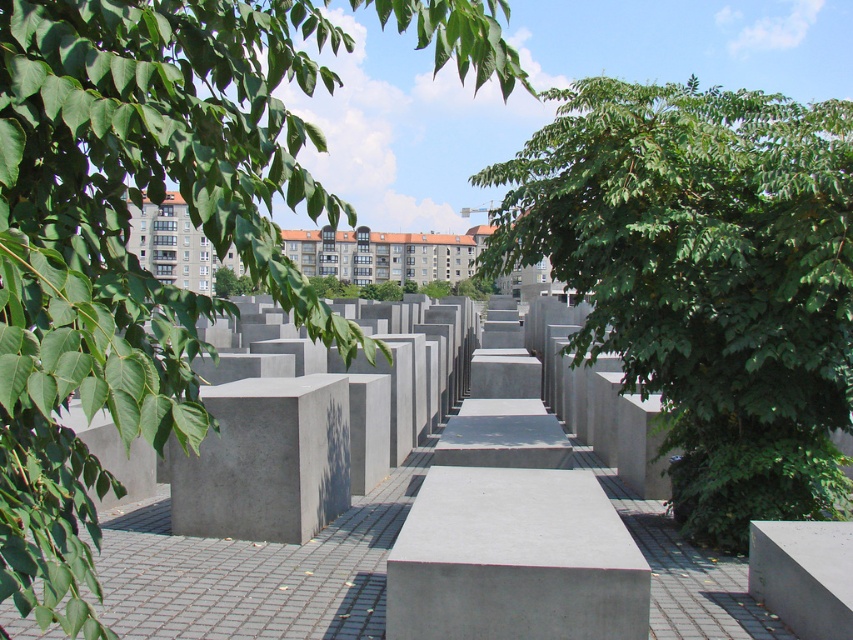
Question: Among these points, which one is nearest to the camera?

Choices:
 (A) (556, 621)
 (B) (647, 221)

Answer: (A)

Question: From the image, what is the correct spatial relationship of green leafy tree at upper left in relation to gray concrete bench at center?

Choices:
 (A) above
 (B) below

Answer: (A)

Question: Which point is farther from the camera taking this photo?

Choices:
 (A) (556, 627)
 (B) (643, 378)

Answer: (B)

Question: Can you confirm if green leafy tree at upper left is positioned below gray concrete bench at center?

Choices:
 (A) no
 (B) yes

Answer: (A)

Question: Is green leafy tree at center to the left of gray concrete bench at center from the viewer's perspective?

Choices:
 (A) no
 (B) yes

Answer: (A)

Question: Considering the real-world distances, which object is closest to the green leafy tree at center?

Choices:
 (A) gray concrete bench at center
 (B) green leafy tree at upper left

Answer: (A)